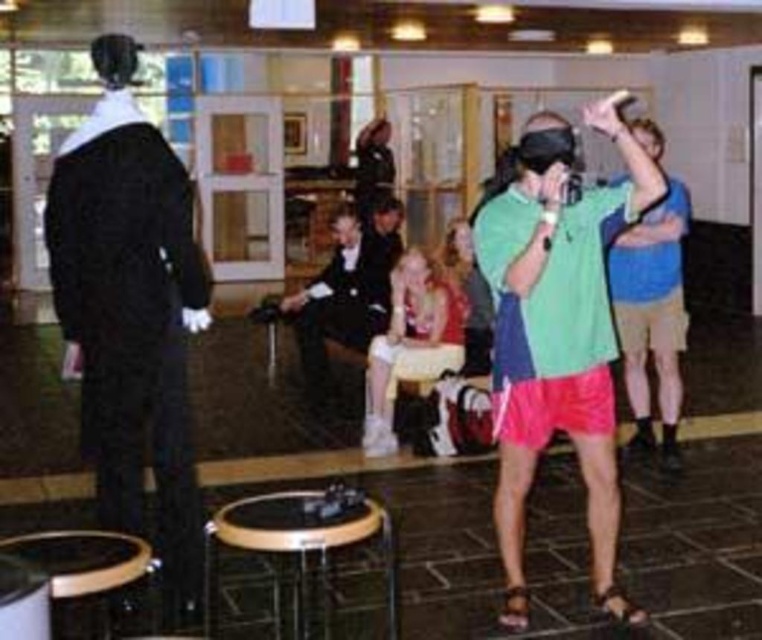
Question: Does black fabric suit at left have a greater width compared to black formal suit at center?

Choices:
 (A) no
 (B) yes

Answer: (A)

Question: Which object appears farthest from the camera in this image?

Choices:
 (A) green cotton shirt at center
 (B) matte black nun at center

Answer: (B)

Question: Which point is farther to the camera?

Choices:
 (A) black fabric suit at left
 (B) blue cotton shirt at upper right

Answer: (B)

Question: Is blue cotton shirt at upper right wider than matte pink dress at center?

Choices:
 (A) yes
 (B) no

Answer: (B)

Question: Is black fabric suit at left to the left of blue cotton shirt at upper right from the viewer's perspective?

Choices:
 (A) yes
 (B) no

Answer: (A)

Question: Which point is farther to the camera?

Choices:
 (A) (367, 401)
 (B) (623, 602)
 (C) (376, 276)
 (D) (476, 369)

Answer: (C)